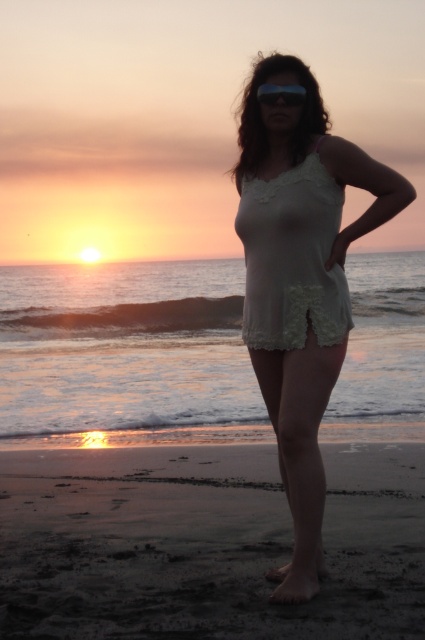
You are a photographer trying to capture the perfect sunset silhouette. You notice the white lace top at center in the scene. Based on its position, can you estimate whether it is located closer to the bottom or the top of the image?

The white lace top at center is located at point (302, 285). Since the y coordinate is 0.711, which is closer to 1.0, it is positioned closer to the bottom of the image.

You are a photographer trying to capture the sunset scene. You have two points marked on your viewfinder at coordinates point (363, 492) and point (266, 84). Which point is closer to the camera?

Point (363, 492) is further to the camera than point (266, 84), so the closer point to the camera is point (266, 84).

You are a photographer trying to capture the sunset with the person in the frame. You notice the white lace top at center and the transparent plastic goggles at center. Which object should you focus on to ensure the subject is clearly visible in the photo?

The white lace top at center is larger in size than the transparent plastic goggles at center, so focusing on the white lace top at center would ensure the subject is clearly visible in the photo.